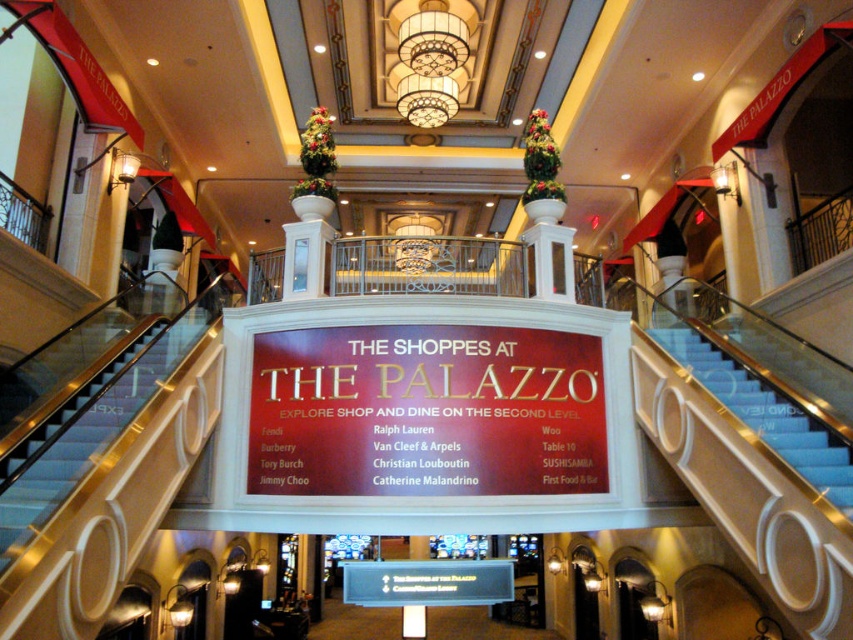
Is shiny gold sign at center above metallic blue stairs at left?

Actually, shiny gold sign at center is below metallic blue stairs at left.

Who is positioned more to the right, shiny gold sign at center or metallic blue stairs at left?

From the viewer's perspective, shiny gold sign at center appears more on the right side.

The image size is (853, 640). Find the location of `shiny gold sign at center`. shiny gold sign at center is located at coordinates (426, 412).

Between point (601, 412) and point (769, 445), which one is positioned behind?

The point (601, 412) is more distant.

Looking at this image, between shiny gold sign at center and blue carpeted stairs at center, which one has more height?

blue carpeted stairs at center

Does point (566, 355) lie behind point (677, 348)?

No, it is in front of (677, 348).

You are a GUI agent. You are given a task and a screenshot of the screen. Output one action in this format:
    pyautogui.click(x=<x>, y=<y>)
    Task: Click on the shiny gold sign at center
    The image size is (853, 640).
    Given the screenshot: What is the action you would take?
    pyautogui.click(x=426, y=412)

Who is positioned more to the left, metallic blue stairs at left or blue carpeted stairs at center?

Positioned to the left is metallic blue stairs at left.

Who is taller, metallic blue stairs at left or blue carpeted stairs at center?

With more height is metallic blue stairs at left.

Find the location of a particular element. metallic blue stairs at left is located at coordinates (80, 435).